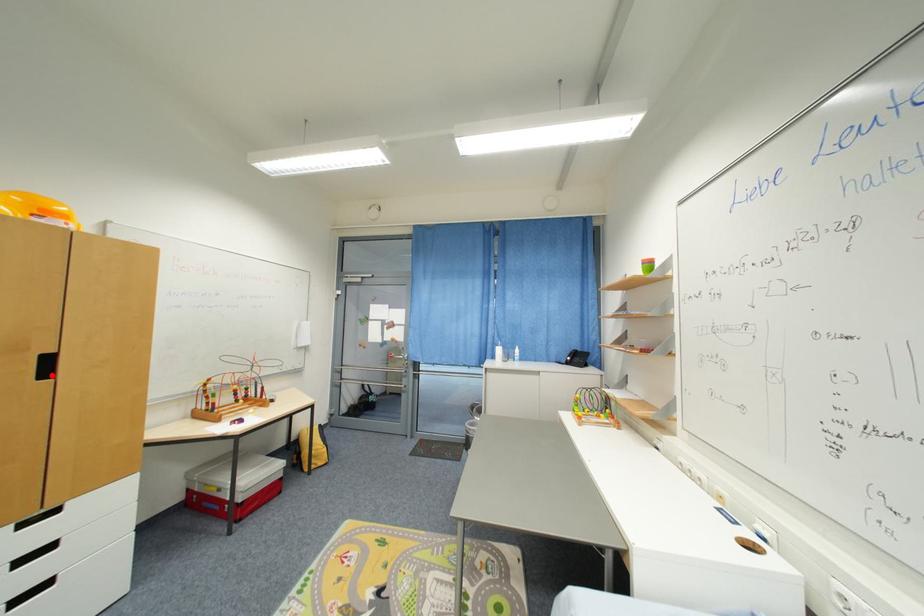
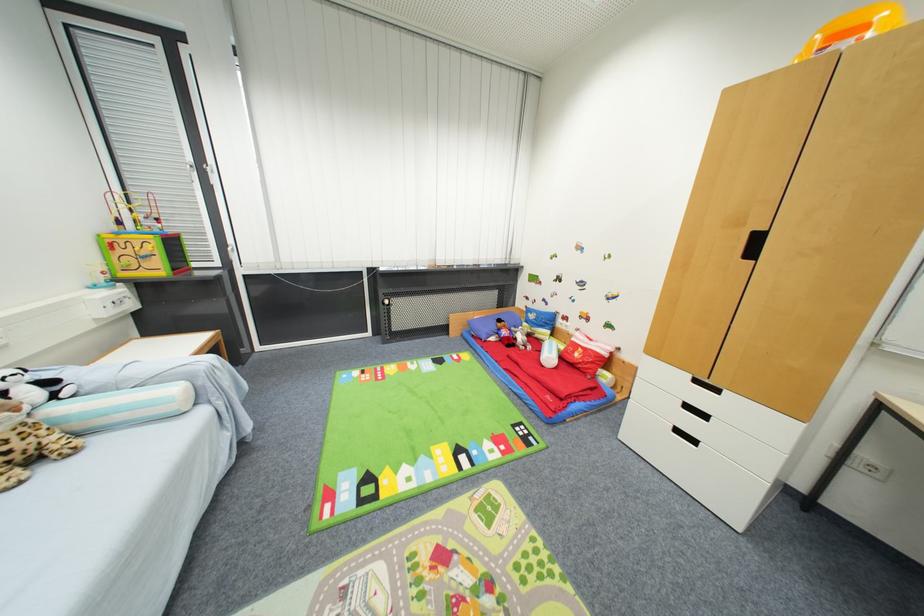
Where in the second image is the point corresponding to the highlighted location from the first image?

(757, 254)